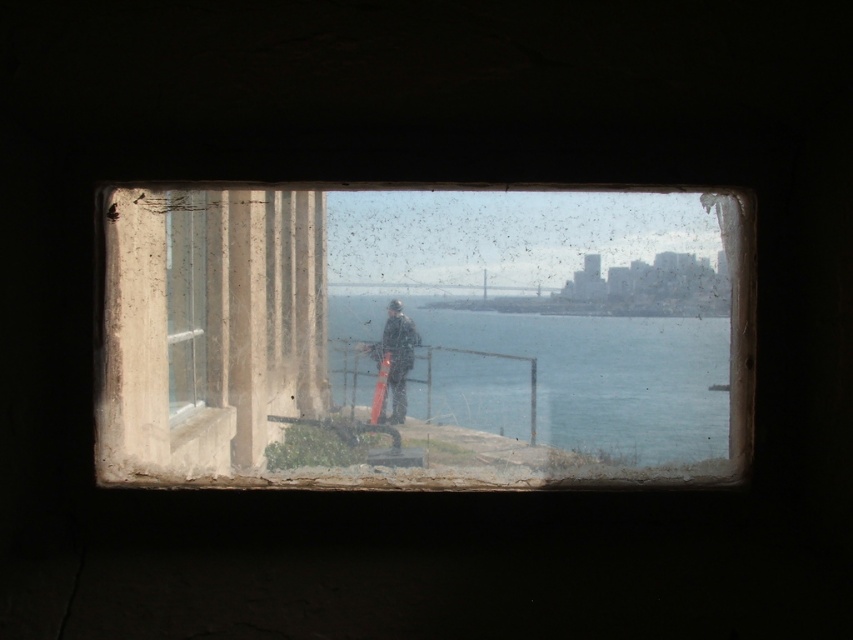
Between point (750, 300) and point (396, 396), which one is positioned in front?

Point (750, 300)

Is matte glass window at center positioned at the back of dark gray fabric jacket at center?

No, matte glass window at center is closer to the viewer.

At what (x,y) coordinates should I click in order to perform the action: click on matte glass window at center. Please return your answer as a coordinate pair (x, y). The height and width of the screenshot is (640, 853). Looking at the image, I should click on (425, 337).

Who is more distant from viewer, [537,401] or [397,406]?

The point [397,406] is more distant.

From the picture: Does clear blue water at center have a smaller size compared to dark gray fabric jacket at center?

Incorrect, clear blue water at center is not smaller in size than dark gray fabric jacket at center.

Does point (526, 355) come behind point (412, 337)?

No, (526, 355) is in front of (412, 337).

Identify the location of clear blue water at center. This screenshot has height=640, width=853. (576, 381).

Between point (410, 208) and point (614, 438), which one is positioned in front?

Point (614, 438)

Does matte glass window at center have a lesser width compared to clear blue water at center?

No.

Does point (621, 253) come closer to viewer compared to point (415, 371)?

No, (621, 253) is behind (415, 371).

Find the location of a particular element. The width and height of the screenshot is (853, 640). matte glass window at center is located at coordinates (425, 337).